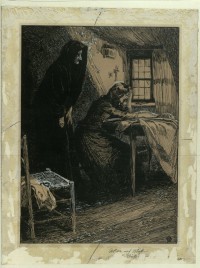
You are a GUI agent. You are given a task and a screenshot of the screen. Output one action in this format:
    pyautogui.click(x=<x>, y=<y>)
    Task: Click on the table
    This screenshot has height=268, width=200.
    Given the screenshot: What is the action you would take?
    pyautogui.click(x=132, y=152)